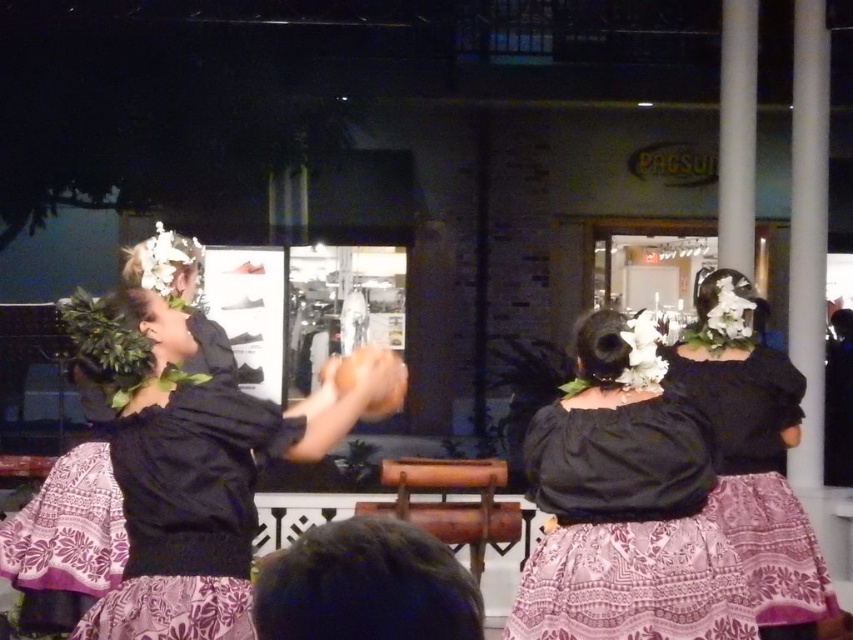
You are a photographer positioned at the origin point of the image. You want to capture a closeup of the matte black blouse at center. Which direction should you move your camera to focus on it?

The matte black blouse at center is located at point 0.789 on the x and 0.733 on the y axis. Since the origin is at the bottom left corner, you should move your camera to the right and slightly upwards to focus on the blouse.

You are standing at the point marked as point (138, 417) in the image. The camera is positioned 10 feet away from you. Is the camera closer to you than 10 feet?

The distance of point (138, 417) from camera is 8.25 feet, so the camera is closer to you than 10 feet.

You are a photographer trying to capture a group photo of the performers. You have a camera with a lens that can focus on objects within a 5 feet range. If you are positioned directly in front of the purple printed dress at center, can you also capture the black matte dress at upper center in focus without moving the camera?

The distance between the purple printed dress at center and the black matte dress at upper center is 5.63 feet. Since the camera lens can only focus within 5 feet, you cannot capture both in focus without moving the camera.